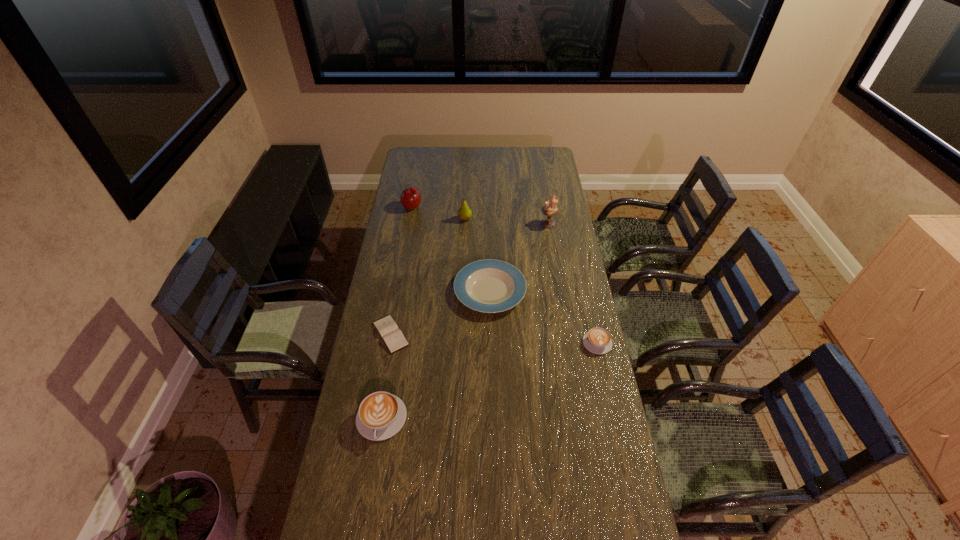
The height and width of the screenshot is (540, 960). In order to click on vacant region located 0.080m on the side of the nearest object with the handle in this screenshot , I will do `click(372, 470)`.

Image resolution: width=960 pixels, height=540 pixels. Find the location of `vacant space located 0.100m on the side of the rightmost object with the handle`. vacant space located 0.100m on the side of the rightmost object with the handle is located at coordinates [x=589, y=310].

Image resolution: width=960 pixels, height=540 pixels. I want to click on free space located on the side of the rightmost object with the handle, so click(583, 278).

This screenshot has width=960, height=540. I want to click on vacant region located 0.130m on the side of the rightmost object with the handle, so click(x=588, y=305).

Find the location of a particular element. free space located on the left of the pear is located at coordinates (429, 219).

You are a GUI agent. You are given a task and a screenshot of the screen. Output one action in this format:
    pyautogui.click(x=<x>, y=<y>)
    Task: Click on the vacant space located 0.260m on the back of the tallest object
    
    Given the screenshot: What is the action you would take?
    pyautogui.click(x=542, y=188)

The image size is (960, 540). I want to click on free point located 0.140m on the right of the apple, so tap(449, 207).

The height and width of the screenshot is (540, 960). In order to click on free location located on the right of the plate in this screenshot , I will do `click(544, 291)`.

The image size is (960, 540). In order to click on free space located on the back of the shortest object in this screenshot , I will do pos(397,295).

Where is `cappuccino that is at the left edge`? The width and height of the screenshot is (960, 540). cappuccino that is at the left edge is located at coordinates (381, 415).